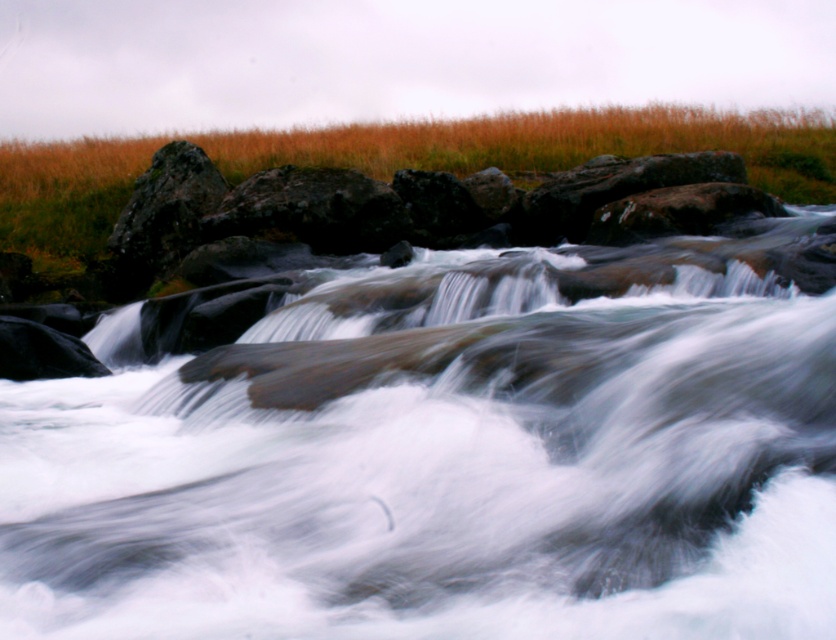
You are a photographer planning to capture the golden grass at upper center and white smooth water at center in your next shot. Based on their sizes in the current image, which object should you focus on if you want to highlight a larger subject in your photo?

The golden grass at upper center should be focused on because it is larger than the white smooth water at center, as the white smooth water at center is thinner than golden grass at upper center.

You are standing at the edge of the river and want to reach the point marked at coordinates point (668, 477). The river has a swift current and rocks in the midground. Considering the rocks and the current, can you safely walk to that point?

The point marked at coordinates point (668, 477) is 3.63 meters away from you. However, the river has a swift current and scattered rocks in the midground, which may make the path unstable and dangerous. It is not recommended to attempt walking to that point due to the potential risks posed by the moving water and uneven terrain.

You are a photographer trying to capture a shot of the golden grass at upper center and the white smooth water at center. From your current position, which object would you need to pan your camera to the right to frame?

The golden grass at upper center is to the right of the white smooth water at center. To frame the golden grass at upper center, you would need to pan your camera to the right from the white smooth water at center.